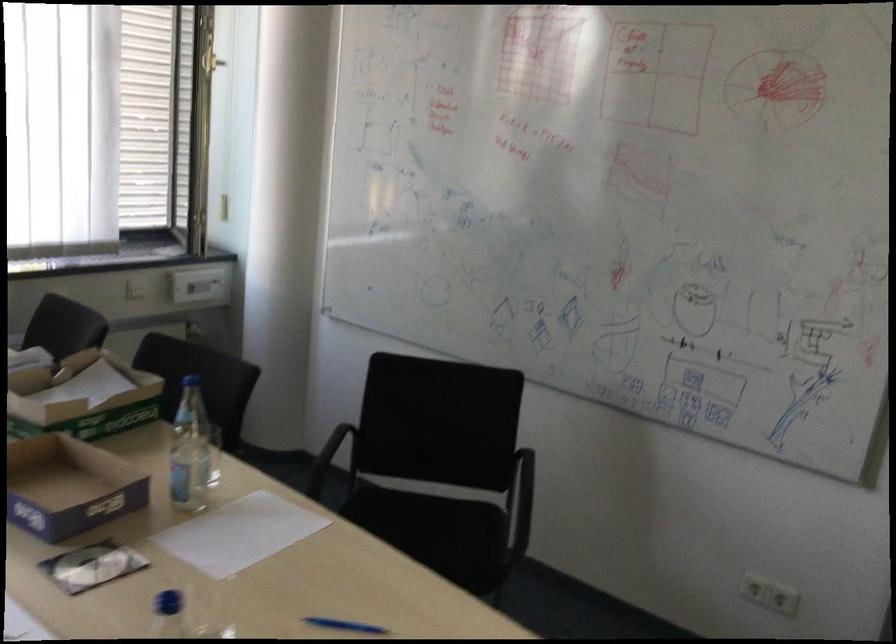
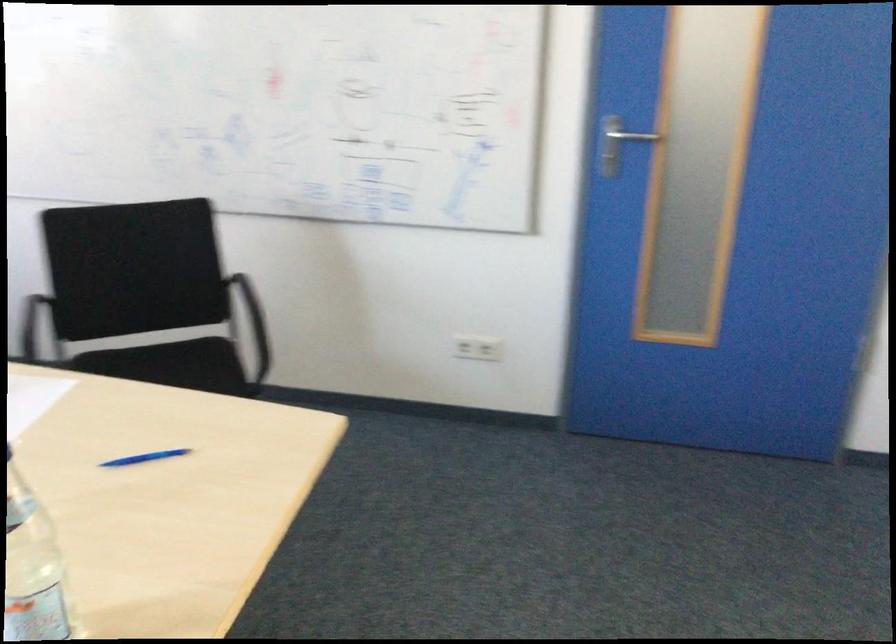
Question: The first image is from the beginning of the video and the second image is from the end. How did the camera likely rotate when shooting the video?

Choices:
 (A) Left
 (B) Right
 (C) Up
 (D) Down

Answer: (B)